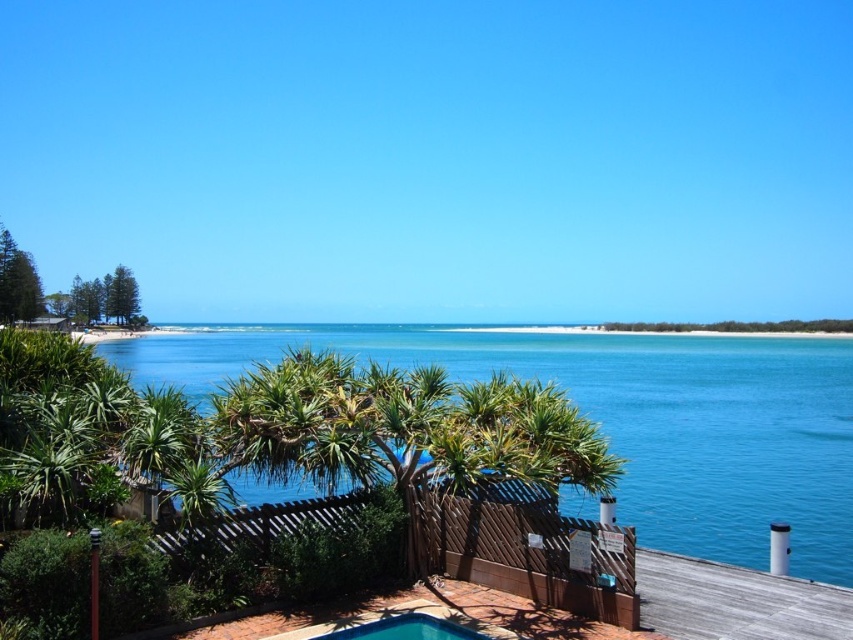
Is blue water at center to the left of blue glossy pool at lower center from the viewer's perspective?

Incorrect, blue water at center is not on the left side of blue glossy pool at lower center.

Can you confirm if blue water at center is positioned above blue glossy pool at lower center?

Correct, blue water at center is located above blue glossy pool at lower center.

Find the location of `blue water at center`. blue water at center is located at coordinates (622, 417).